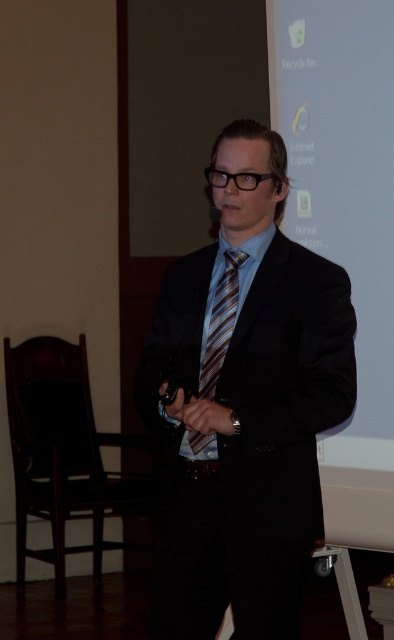
Which of these two, matte black suit at center or brown striped tie at center, stands shorter?

With less height is brown striped tie at center.

Does matte black suit at center lie in front of brown striped tie at center?

No, matte black suit at center is behind brown striped tie at center.

Locate an element on the screen. matte black suit at center is located at coordinates (243, 403).

You are a GUI agent. You are given a task and a screenshot of the screen. Output one action in this format:
    pyautogui.click(x=<x>, y=<y>)
    Task: Click on the matte black suit at center
    This screenshot has height=640, width=394.
    Given the screenshot: What is the action you would take?
    pyautogui.click(x=243, y=403)

Between matte black suit at center and white matte projection screen at upper center, which one is positioned lower?

matte black suit at center is below.

Find the location of a particular element. This screenshot has width=394, height=640. matte black suit at center is located at coordinates (243, 403).

In the scene shown: Is white matte projection screen at upper center to the right of brown striped tie at center from the viewer's perspective?

Indeed, white matte projection screen at upper center is positioned on the right side of brown striped tie at center.

Does point (321, 70) come farther from viewer compared to point (208, 397)?

That is True.

At what (x,y) coordinates should I click in order to perform the action: click on white matte projection screen at upper center. Please return your answer as a coordinate pair (x, y). This screenshot has width=394, height=640. Looking at the image, I should click on point(341,164).